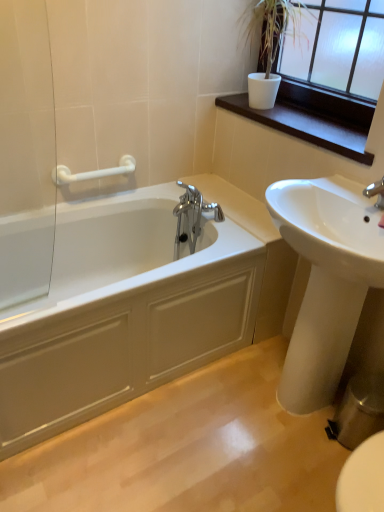
Question: From a real-world perspective, is white plastic grab bar at upper left above or below white glossy sink at lower right?

Choices:
 (A) below
 (B) above

Answer: (B)

Question: In terms of width, does white plastic grab bar at upper left look wider or thinner when compared to white glossy sink at lower right?

Choices:
 (A) thin
 (B) wide

Answer: (A)

Question: Which object is the closest to the white glossy sink at lower right?

Choices:
 (A) dark wood window sill at upper right
 (B) white plastic grab bar at upper left
 (C) dark brown wood at upper right
 (D) white glossy bathtub at left

Answer: (A)

Question: Based on their relative distances, which object is nearer to the white glossy bathtub at left?

Choices:
 (A) dark brown wood at upper right
 (B) white glossy sink at lower right
 (C) white plastic grab bar at upper left
 (D) dark wood window sill at upper right

Answer: (B)